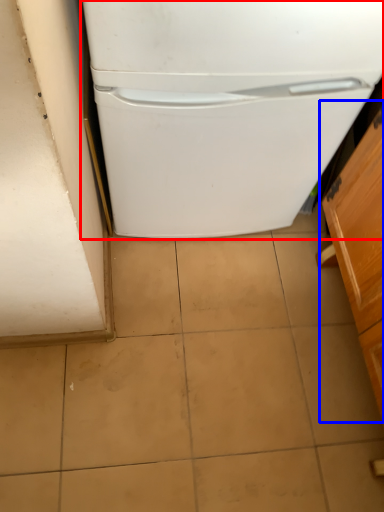
Question: Among these objects, which one is nearest to the camera, refrigerator (highlighted by a red box) or cabinetry (highlighted by a blue box)?

Choices:
 (A) refrigerator
 (B) cabinetry

Answer: (B)